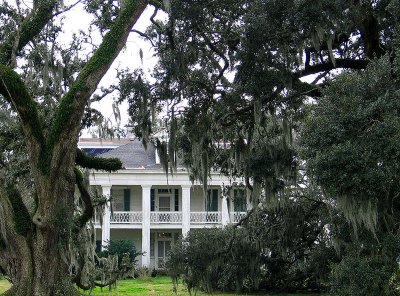
Find the location of `door`. door is located at coordinates (166, 254).